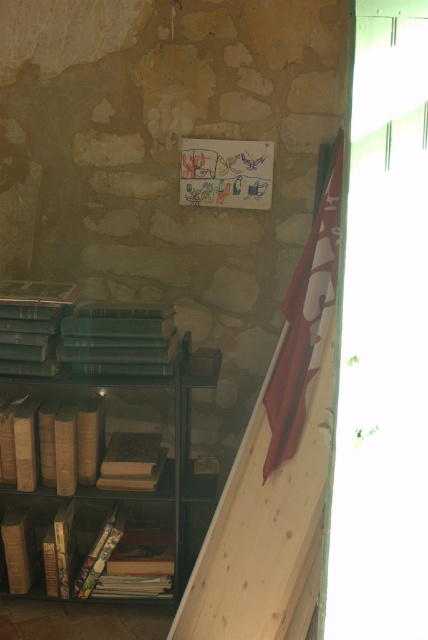
Question: From the image, what is the correct spatial relationship of green leather book at center in relation to red fabric flag at upper right?

Choices:
 (A) above
 (B) below

Answer: (B)

Question: Which point is closer to the camera?

Choices:
 (A) (79, 356)
 (B) (24, 586)
 (C) (89, 506)

Answer: (A)

Question: Which of the following is the farthest from the observer?

Choices:
 (A) (139, 445)
 (B) (26, 570)
 (C) (103, 314)

Answer: (A)

Question: Is red fabric flag at upper right further to camera compared to wooden book at center?

Choices:
 (A) no
 (B) yes

Answer: (A)

Question: Is brown leather bookcase at lower left bigger than green leather book at center?

Choices:
 (A) no
 (B) yes

Answer: (B)

Question: Estimate the real-world distances between objects in this image. Which object is farther from the hardcover books at lower left?

Choices:
 (A) green leather book at center
 (B) red fabric flag at upper right

Answer: (B)